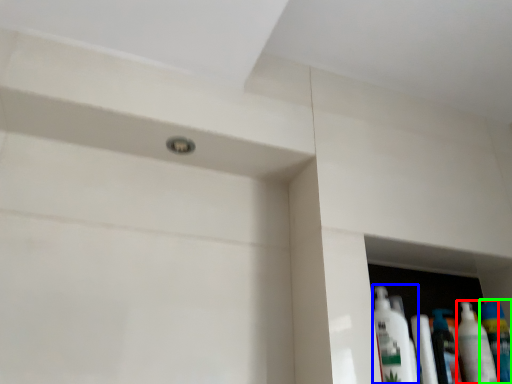
Question: Based on their relative distances, which object is nearer to cleaning product (highlighted by a red box)? Choose from cleaning product (highlighted by a blue box) and mouthwash (highlighted by a green box).

Choices:
 (A) cleaning product
 (B) mouthwash

Answer: (B)